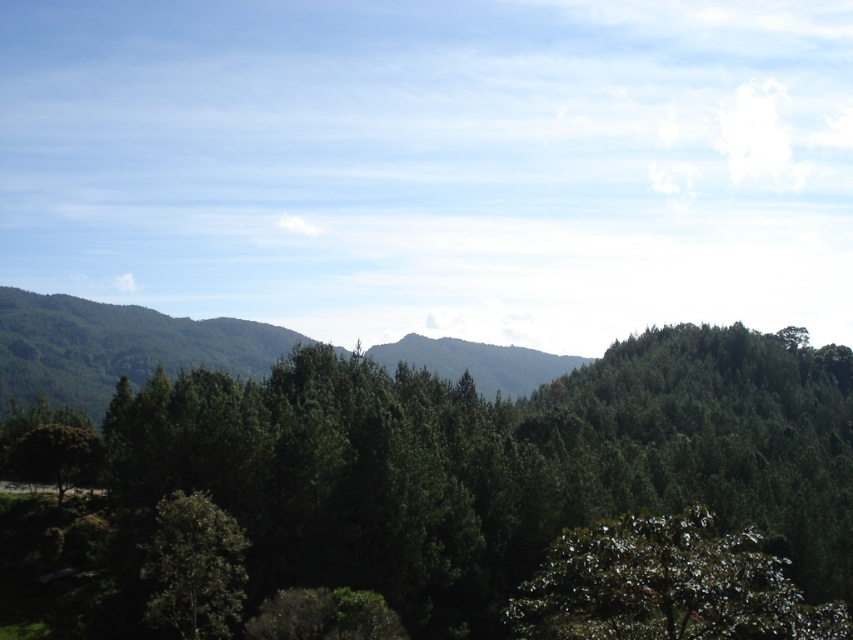
Does green leafy hillside at left appear on the left side of green matte tree at lower left?

Indeed, green leafy hillside at left is positioned on the left side of green matte tree at lower left.

Which is in front, point (94, 390) or point (216, 508)?

Positioned in front is point (216, 508).

Where is `green leafy hillside at left`? The width and height of the screenshot is (853, 640). green leafy hillside at left is located at coordinates (117, 346).

Can you confirm if green leafy forest at center is positioned below green matte tree at lower left?

Yes, green leafy forest at center is below green matte tree at lower left.

Describe the element at coordinates (450, 476) in the screenshot. The height and width of the screenshot is (640, 853). I see `green leafy forest at center` at that location.

Identify the location of green leafy forest at center. (450, 476).

This screenshot has width=853, height=640. Find the location of `green leafy forest at center`. green leafy forest at center is located at coordinates (450, 476).

Is point (714, 541) farther from viewer compared to point (233, 518)?

No.

Is green glossy tree at lower right taller than green matte tree at lower left?

Yes, green glossy tree at lower right is taller than green matte tree at lower left.

Which is in front, point (566, 604) or point (229, 628)?

Positioned in front is point (566, 604).

This screenshot has height=640, width=853. Find the location of `green glossy tree at lower right`. green glossy tree at lower right is located at coordinates pos(666,586).